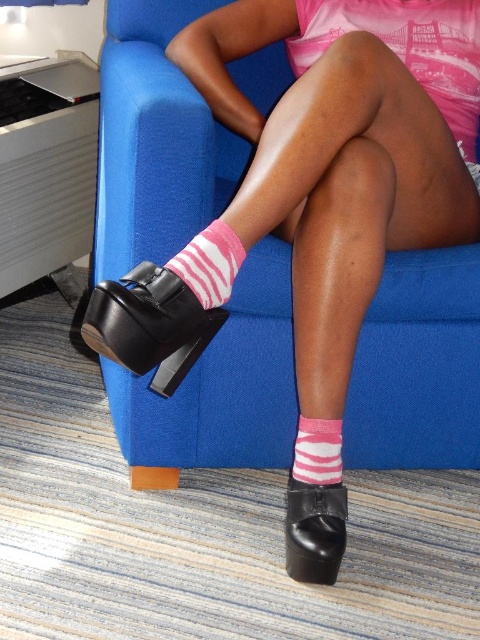
You are taking a photo of the scene and want to focus on both the point at [136,284] and the point at [327,465]. Which point should you adjust your focus to first to ensure both are in clear view?

You should focus on point [136,284] first because it is closer to the camera than point [327,465]. This way, adjusting focus from near to far will help both points come into clarity.